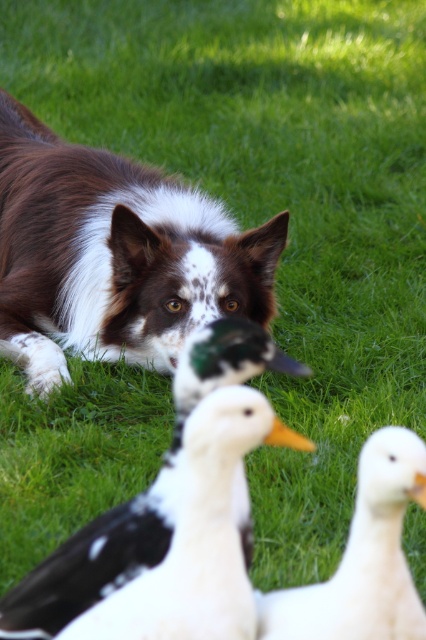
Question: Which of the following is the closest to the observer?

Choices:
 (A) (345, 620)
 (B) (184, 570)

Answer: (A)

Question: From the image, what is the correct spatial relationship of brown speckled fur at upper left in relation to white matte goose at lower right?

Choices:
 (A) left
 (B) right

Answer: (A)

Question: From the image, what is the correct spatial relationship of brown speckled fur at upper left in relation to white matte goose at center?

Choices:
 (A) right
 (B) left

Answer: (B)

Question: Estimate the real-world distances between objects in this image. Which object is farther from the white matte goose at center?

Choices:
 (A) white matte goose at lower right
 (B) brown speckled fur at upper left

Answer: (B)

Question: Is brown speckled fur at upper left positioned at the back of white matte goose at lower right?

Choices:
 (A) no
 (B) yes

Answer: (B)

Question: Which point is farther from the camera taking this photo?

Choices:
 (A) (209, 593)
 (B) (374, 540)

Answer: (B)